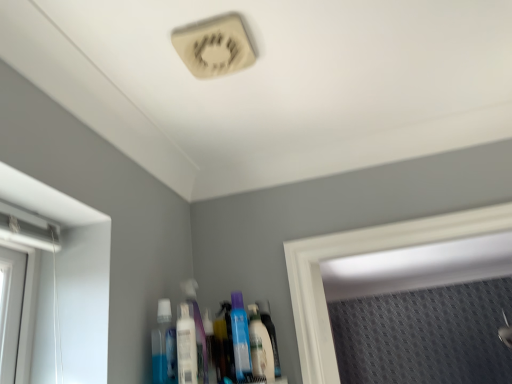
Question: Can you confirm if white plastic mouthwash at center, the 2th mouthwash viewed from the right, is thinner than translucent plastic bottle at center?

Choices:
 (A) no
 (B) yes

Answer: (A)

Question: Considering the relative sizes of white plastic mouthwash at center, the 2th mouthwash viewed from the right, and translucent plastic bottle at center in the image provided, is white plastic mouthwash at center, the 2th mouthwash viewed from the right, shorter than translucent plastic bottle at center?

Choices:
 (A) yes
 (B) no

Answer: (B)

Question: Is white plastic mouthwash at center, the 2th mouthwash viewed from the right, at the left side of translucent plastic bottle at center?

Choices:
 (A) no
 (B) yes

Answer: (B)

Question: Is white plastic mouthwash at center, the 2th mouthwash viewed from the right, further to the viewer compared to translucent plastic bottle at center?

Choices:
 (A) no
 (B) yes

Answer: (A)

Question: Is translucent plastic bottle at center at the back of white plastic mouthwash at center, the 2th mouthwash viewed from the right?

Choices:
 (A) yes
 (B) no

Answer: (B)

Question: From the image's perspective, is white plastic mouthwash at center, placed as the 2th mouthwash when sorted from left to right, under translucent plastic bottle at center?

Choices:
 (A) yes
 (B) no

Answer: (B)

Question: Is translucent plastic bottle at center shorter than white plastic mouthwash at center, the 2th mouthwash viewed from the right?

Choices:
 (A) no
 (B) yes

Answer: (B)

Question: From a real-world perspective, is translucent plastic bottle at center on white plastic mouthwash at center, placed as the 2th mouthwash when sorted from left to right?

Choices:
 (A) yes
 (B) no

Answer: (B)

Question: Is there a large distance between translucent plastic bottle at center and white plastic mouthwash at center, placed as the 2th mouthwash when sorted from left to right?

Choices:
 (A) no
 (B) yes

Answer: (A)

Question: From the image's perspective, would you say translucent plastic bottle at center is positioned over white plastic mouthwash at center, placed as the 2th mouthwash when sorted from left to right?

Choices:
 (A) yes
 (B) no

Answer: (B)

Question: Is translucent plastic bottle at center looking in the opposite direction of white plastic mouthwash at center, placed as the 2th mouthwash when sorted from left to right?

Choices:
 (A) yes
 (B) no

Answer: (B)

Question: Does translucent plastic bottle at center have a smaller size compared to white plastic mouthwash at center, the 2th mouthwash viewed from the right?

Choices:
 (A) no
 (B) yes

Answer: (B)

Question: Is blue translucent bottle at lower center, which ranks as the 3th mouthwash in right-to-left order, closer to the viewer compared to white plastic mouthwash at center, placed as the 2th mouthwash when sorted from left to right?

Choices:
 (A) no
 (B) yes

Answer: (A)